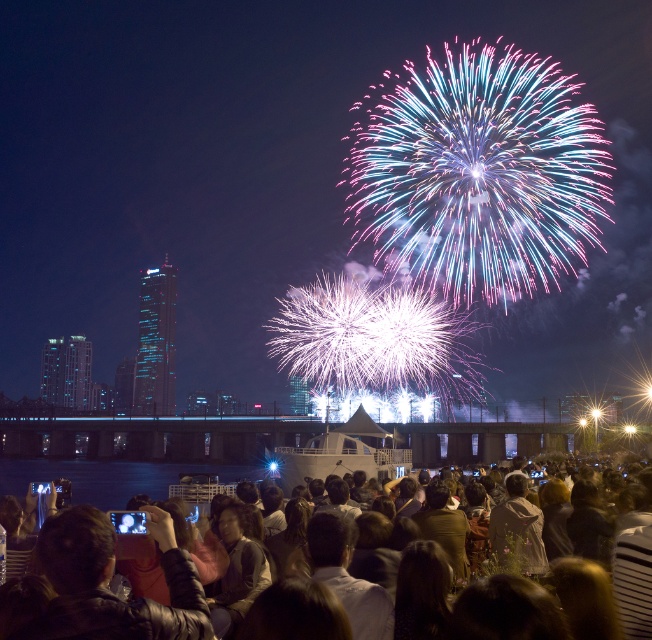
Question: Which object is closer to the camera taking this photo?

Choices:
 (A) transparent water at lower center
 (B) dark brown hair at lower center

Answer: (B)

Question: Can you confirm if transparent water at lower center is positioned below dark brown hair at lower center?

Choices:
 (A) no
 (B) yes

Answer: (B)

Question: Can you confirm if transparent water at lower center is thinner than dark brown hair at lower center?

Choices:
 (A) no
 (B) yes

Answer: (B)

Question: Does transparent water at lower center come behind dark brown hair at lower center?

Choices:
 (A) yes
 (B) no

Answer: (A)

Question: Which of the following is the closest to the observer?

Choices:
 (A) transparent water at lower center
 (B) dark brown hair at lower center

Answer: (B)